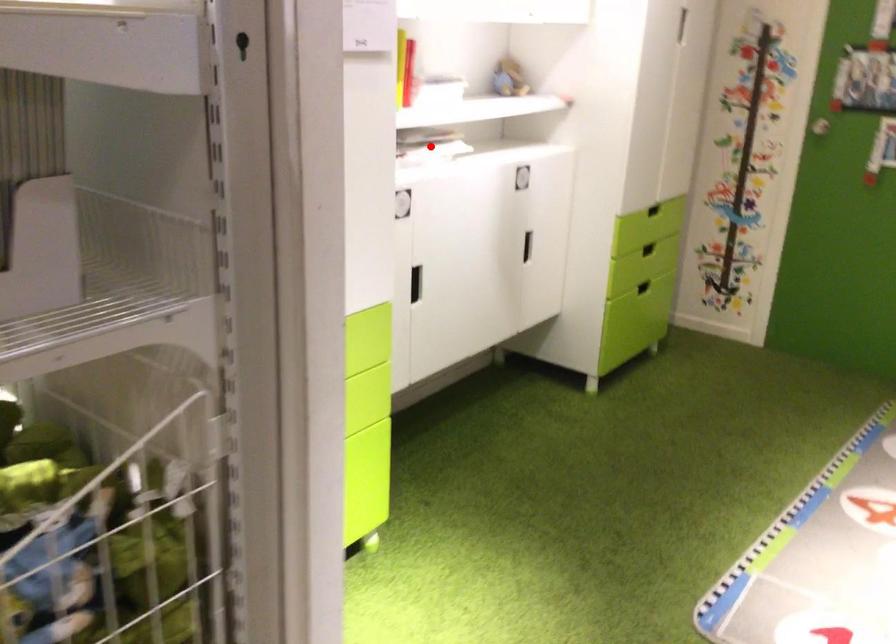
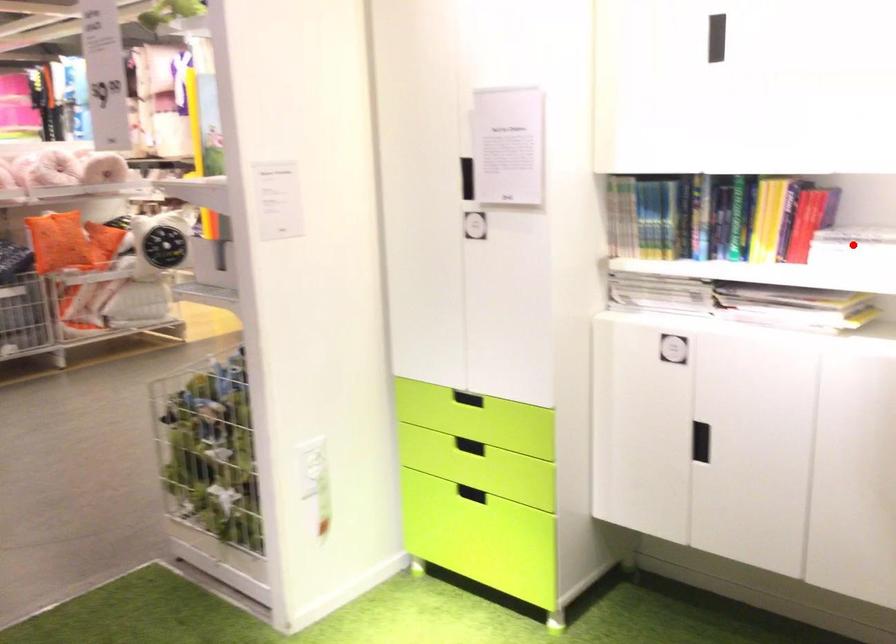
I am providing you with two images of the same scene from different viewpoints. A red point is marked on the first image and another point is marked on the second image. Is the marked point in image1 the same physical position as the marked point in image2?

No